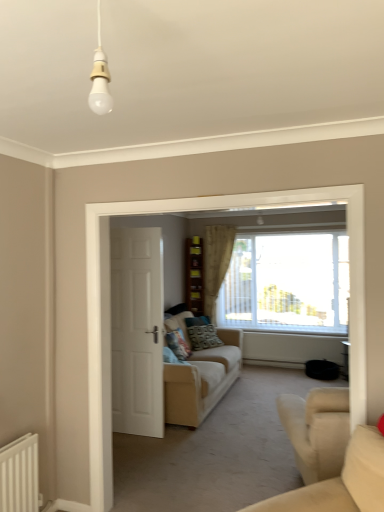
At what (x,y) coordinates should I click in order to perform the action: click on beige fabric curtain at center. Please return your answer as a coordinate pair (x, y). Looking at the image, I should click on (216, 263).

The height and width of the screenshot is (512, 384). Describe the element at coordinates (194, 275) in the screenshot. I see `wooden shelves at center` at that location.

At what (x,y) coordinates should I click in order to perform the action: click on beige fabric couch at lower right, placed as the second studio couch when sorted from back to front. Please return your answer as a coordinate pair (x, y). Looking at the image, I should click on (341, 482).

The height and width of the screenshot is (512, 384). Find the location of `patterned fabric pillow at center, which appears as the 2th pillow when viewed from the right`. patterned fabric pillow at center, which appears as the 2th pillow when viewed from the right is located at coordinates (178, 344).

What are the coordinates of `white matte door at center` in the screenshot? It's located at (137, 331).

Which of these two, beige fabric couch at lower right, placed as the second studio couch when sorted from back to front, or beige fabric curtain at center, stands taller?

beige fabric curtain at center is taller.

Is point (366, 460) positioned behind point (209, 247)?

No, (366, 460) is closer to viewer.

Which object is further away from the camera, beige fabric couch at lower right, placed as the first studio couch when sorted from front to back, or beige fabric curtain at center?

beige fabric curtain at center is further from the camera.

Is the depth of beige fabric curtain at center greater than that of patterned fabric pillow at center, the 1th pillow positioned from the back?

Yes, beige fabric curtain at center is behind patterned fabric pillow at center, the 1th pillow positioned from the back.

Considering the sizes of objects beige fabric curtain at center and patterned fabric pillow at center, the 1th pillow positioned from the back, in the image provided, who is smaller, beige fabric curtain at center or patterned fabric pillow at center, the 1th pillow positioned from the back,?

Smaller between the two is patterned fabric pillow at center, the 1th pillow positioned from the back.

Is beige fabric curtain at center taller or shorter than patterned fabric pillow at center, arranged as the second pillow when viewed from the front?

Considering their sizes, beige fabric curtain at center has more height than patterned fabric pillow at center, arranged as the second pillow when viewed from the front.

Which object is thinner, beige fabric curtain at center or patterned fabric pillow at center, which ranks as the second pillow in left-to-right order?

beige fabric curtain at center.

Is beige fabric couch at center, placed as the second studio couch when sorted from front to back, turned away from white matte door at center?

No, beige fabric couch at center, placed as the second studio couch when sorted from front to back,'s orientation is not away from white matte door at center.

Which object is wider, beige fabric couch at center, placed as the second studio couch when sorted from front to back, or white matte door at center?

With larger width is beige fabric couch at center, placed as the second studio couch when sorted from front to back.

Where is `door lying on the left of beige fabric couch at center, the 1th studio couch in the back-to-front sequence`? door lying on the left of beige fabric couch at center, the 1th studio couch in the back-to-front sequence is located at coordinates 137,331.

Considering the positions of objects beige fabric couch at center, placed as the second studio couch when sorted from front to back, and white matte door at center in the image provided, who is more to the left, beige fabric couch at center, placed as the second studio couch when sorted from front to back, or white matte door at center?

white matte door at center is more to the left.

How many degrees apart are the facing directions of beige fabric curtain at center and beige fabric couch at lower right, placed as the second studio couch when sorted from back to front?

The angular difference between beige fabric curtain at center and beige fabric couch at lower right, placed as the second studio couch when sorted from back to front, is 46 degrees.

Would you say beige fabric curtain at center is a long distance from beige fabric couch at lower right, placed as the first studio couch when sorted from front to back?

Yes.

Consider the image. Is beige fabric couch at lower right, placed as the second studio couch when sorted from back to front, at the back of beige fabric curtain at center?

No, beige fabric curtain at center is not facing the opposite direction of beige fabric couch at lower right, placed as the second studio couch when sorted from back to front.

Which is nearer, (230, 259) or (311, 495)?

Point (230, 259) is positioned farther from the camera compared to point (311, 495).

Is there a large distance between white matte door at center and beige fabric couch at lower right, placed as the second studio couch when sorted from back to front?

Yes, white matte door at center is far from beige fabric couch at lower right, placed as the second studio couch when sorted from back to front.

Is white matte door at center oriented towards beige fabric couch at lower right, placed as the first studio couch when sorted from front to back?

No, white matte door at center is not turned towards beige fabric couch at lower right, placed as the first studio couch when sorted from front to back.

Do you think white matte door at center is within beige fabric couch at lower right, placed as the first studio couch when sorted from front to back, or outside of it?

white matte door at center is located beyond the bounds of beige fabric couch at lower right, placed as the first studio couch when sorted from front to back.

Is patterned fabric pillow at center, the second pillow positioned from the back, in contact with wooden shelves at center?

No, patterned fabric pillow at center, the second pillow positioned from the back, is not with wooden shelves at center.

The width and height of the screenshot is (384, 512). What are the coordinates of `cabinetry behind the patterned fabric pillow at center, the first pillow from the left` in the screenshot? It's located at (194, 275).

From a real-world perspective, between patterned fabric pillow at center, which appears as the first pillow when viewed from the front, and wooden shelves at center, who is vertically lower?

From a 3D spatial view, patterned fabric pillow at center, which appears as the first pillow when viewed from the front, is below.

Visually, is wooden shelves at center positioned to the left or to the right of white matte door at center?

wooden shelves at center is to the right of white matte door at center.

Is white matte door at center at the back of wooden shelves at center?

That's not correct — wooden shelves at center is not looking away from white matte door at center.

Considering the sizes of wooden shelves at center and white matte door at center in the image, is wooden shelves at center wider or thinner than white matte door at center?

Considering their sizes, wooden shelves at center looks broader than white matte door at center.

From the image's perspective, which one is positioned lower, wooden shelves at center or white matte door at center?

white matte door at center is shown below in the image.

Find the location of `curtain above the beige fabric couch at lower right, placed as the second studio couch when sorted from back to front (from a real-world perspective)`. curtain above the beige fabric couch at lower right, placed as the second studio couch when sorted from back to front (from a real-world perspective) is located at coordinates (216, 263).

From a real-world perspective, which pillow is the 2nd one underneath the beige fabric curtain at center? Please provide its 2D coordinates.

[(204, 337)]

When comparing their distances from white matte door at center, does beige fabric couch at lower right, placed as the second studio couch when sorted from back to front, or patterned fabric pillow at center, the first pillow from the right, seem further?

beige fabric couch at lower right, placed as the second studio couch when sorted from back to front, is positioned further to the anchor white matte door at center.

Which object lies further to the anchor point beige fabric couch at lower right, placed as the second studio couch when sorted from back to front, beige fabric curtain at center or beige fabric couch at center, the 1th studio couch in the back-to-front sequence?

beige fabric curtain at center is further to beige fabric couch at lower right, placed as the second studio couch when sorted from back to front.

From the image, which object appears to be nearer to patterned fabric pillow at center, which appears as the 2th pillow when viewed from the right, beige fabric couch at lower right, placed as the second studio couch when sorted from back to front, or beige fabric couch at center, placed as the second studio couch when sorted from front to back?

Based on the image, beige fabric couch at center, placed as the second studio couch when sorted from front to back, appears to be nearer to patterned fabric pillow at center, which appears as the 2th pillow when viewed from the right.

Looking at the image, which one is located further to beige fabric couch at lower right, placed as the first studio couch when sorted from front to back, patterned fabric pillow at center, which ranks as the second pillow in left-to-right order, or beige fabric couch at center, the 1th studio couch in the back-to-front sequence?

patterned fabric pillow at center, which ranks as the second pillow in left-to-right order.

From the image, which object appears to be nearer to beige fabric couch at lower right, placed as the second studio couch when sorted from back to front, wooden shelves at center or beige fabric couch at center, placed as the second studio couch when sorted from front to back?

beige fabric couch at center, placed as the second studio couch when sorted from front to back, is closer to beige fabric couch at lower right, placed as the second studio couch when sorted from back to front.

Looking at this image, which object lies further to the anchor point white matte door at center, beige fabric curtain at center or patterned fabric pillow at center, which appears as the 2th pillow when viewed from the right?

beige fabric curtain at center lies further to white matte door at center than the other object.

Looking at the image, which one is located closer to wooden shelves at center, beige fabric couch at lower right, placed as the second studio couch when sorted from back to front, or white matte door at center?

white matte door at center lies closer to wooden shelves at center than the other object.

Estimate the real-world distances between objects in this image. Which object is closer to beige fabric couch at lower right, placed as the first studio couch when sorted from front to back, white matte door at center or patterned fabric pillow at center, which appears as the first pillow when viewed from the front?

The object closer to beige fabric couch at lower right, placed as the first studio couch when sorted from front to back, is white matte door at center.

This screenshot has width=384, height=512. I want to click on studio couch between beige fabric couch at lower right, placed as the first studio couch when sorted from front to back, and beige fabric curtain at center in the front-back direction, so click(x=202, y=380).

The image size is (384, 512). Identify the location of pillow positioned between patterned fabric pillow at center, the second pillow positioned from the back, and beige fabric curtain at center from near to far. (204, 337).

Identify the location of door located between beige fabric couch at lower right, placed as the second studio couch when sorted from back to front, and patterned fabric pillow at center, the first pillow from the left, in the depth direction. (137, 331).

Find the location of a particular element. The image size is (384, 512). studio couch between beige fabric couch at lower right, placed as the second studio couch when sorted from back to front, and patterned fabric pillow at center, which appears as the first pillow when viewed from the front, in the front-back direction is located at coordinates (202, 380).